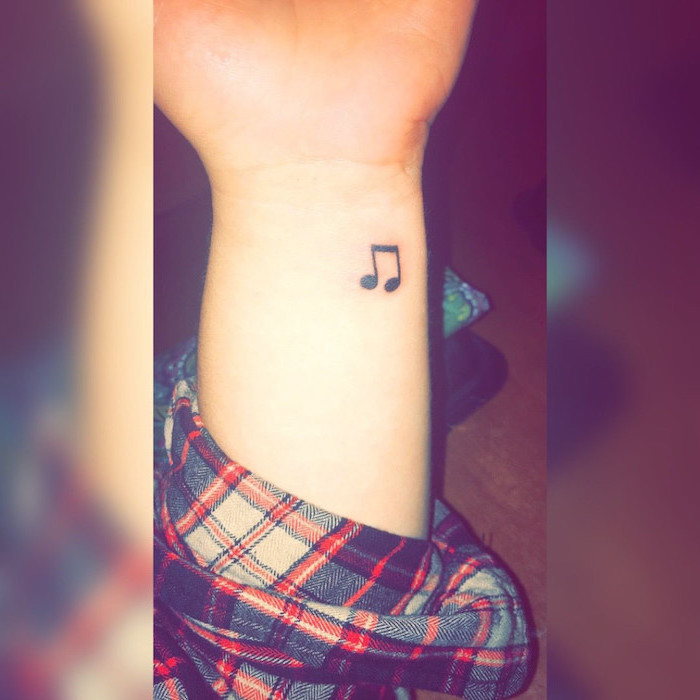
Find the location of a particular element. This screenshot has width=700, height=700. dark floor is located at coordinates (500, 470).